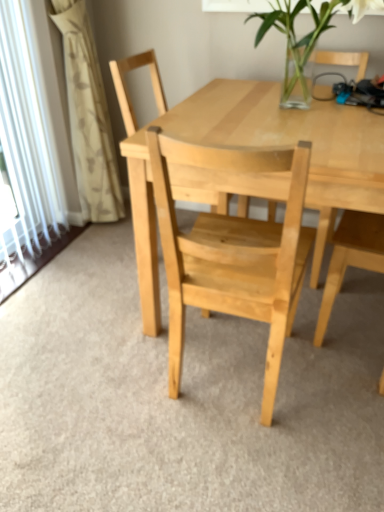
I want to click on free spot in front of white textured curtain at left, so click(x=90, y=260).